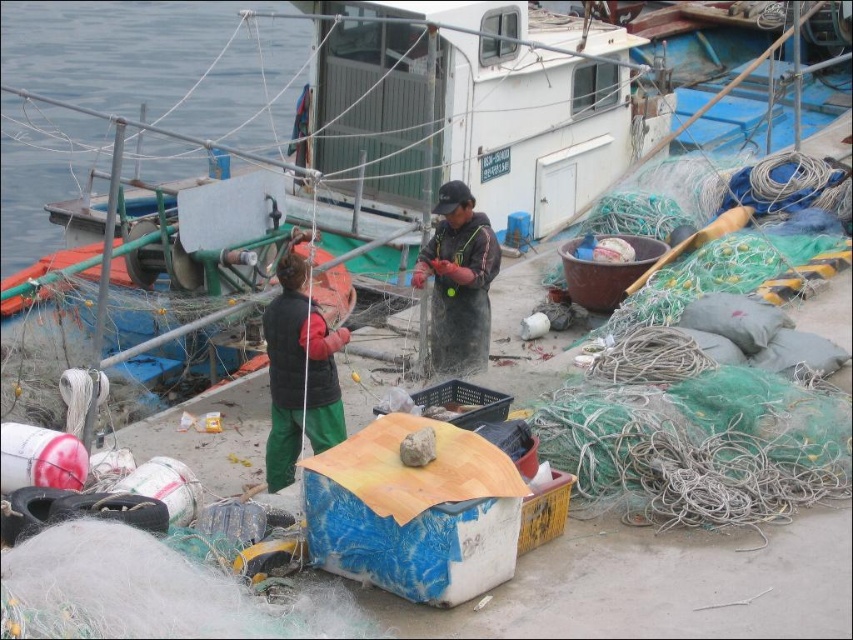
Who is more forward, (276, 476) or (461, 300)?

Point (276, 476)

Does point (337, 333) come farther from viewer compared to point (469, 292)?

No, (337, 333) is closer to viewer.

Find the location of a particular element. dark green fabric jacket at center is located at coordinates (299, 374).